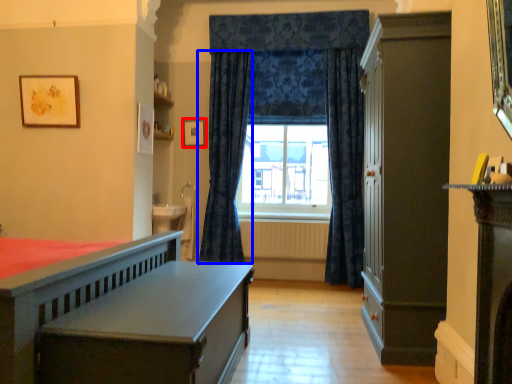
Question: Which object appears closest to the camera in this image, picture frame (highlighted by a red box) or curtain (highlighted by a blue box)?

Choices:
 (A) picture frame
 (B) curtain

Answer: (B)